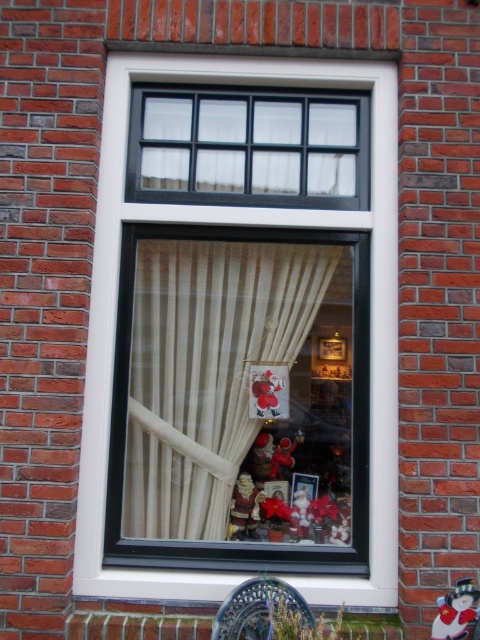
You are standing outside the window and want to touch both the white plastic window at center and the matte brown figurine at center. Which object should you reach for first if you want to touch the one closer to you?

The white plastic window at center is closer to you since it is to the left of the matte brown figurine at center, and in this context, left placement typically indicates proximity.

You are standing in a living room and want to place a 3 meter long ladder against the wall where the white plastic window at center is located. Can you safely place the ladder without it touching the window?

The white plastic window at center is 2.84 meters away from the viewer. Since the ladder is 3 meters long, placing it against the wall might cause the top of the ladder to extend beyond the window, potentially touching it. Therefore, it may not be safe to place the ladder there without risking contact with the window.

Based on the photo, you are decorating a window for the holidays and have placed a beige sheer curtain at center and a matte brown figurine at center. Which object is taller?

The beige sheer curtain at center is taller than the matte brown figurine at center.